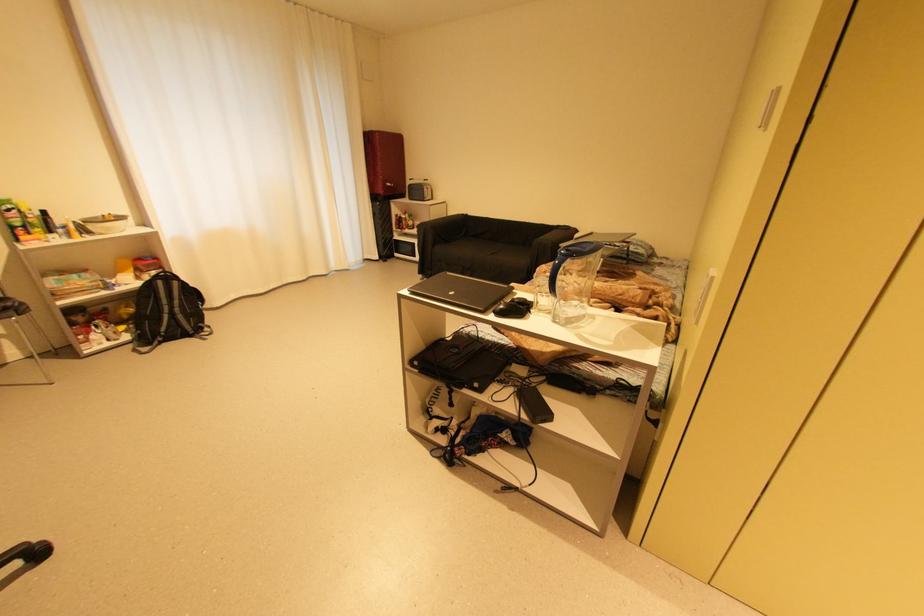
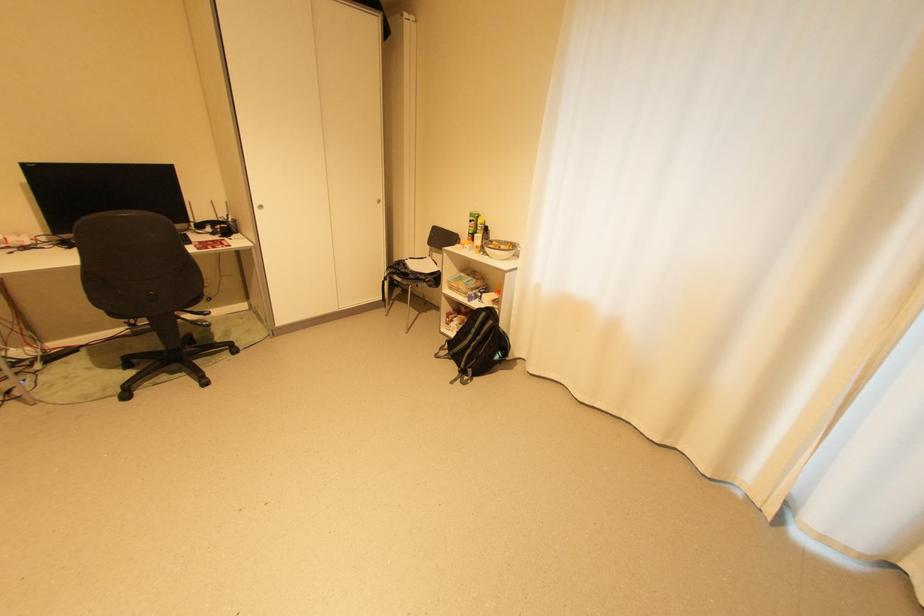
The point at (167, 282) is marked in the first image. Where is the corresponding point in the second image?

(492, 314)